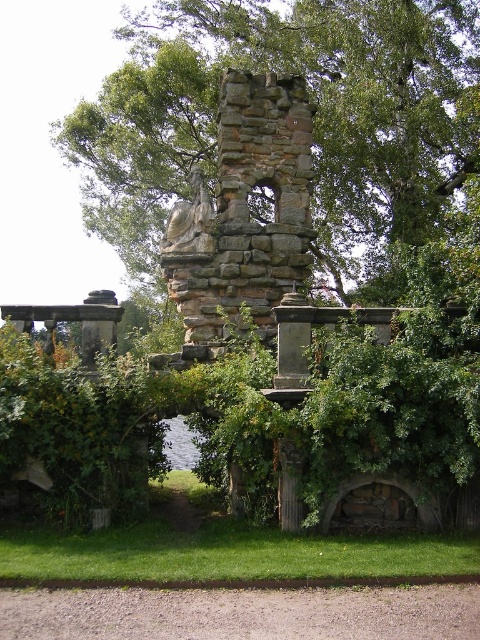
Question: Is green leafy tree at center further to camera compared to rustic stone chimney at center?

Choices:
 (A) no
 (B) yes

Answer: (B)

Question: Which point is farther to the camera?

Choices:
 (A) green leafy tree at center
 (B) rustic stone chimney at center

Answer: (A)

Question: Which of the following is the farthest from the observer?

Choices:
 (A) green leafy tree at center
 (B) rustic stone chimney at center

Answer: (A)

Question: Is green leafy tree at center positioned in front of rustic stone chimney at center?

Choices:
 (A) yes
 (B) no

Answer: (B)

Question: Which point is closer to the camera?

Choices:
 (A) rustic stone chimney at center
 (B) green leafy tree at center

Answer: (A)

Question: Can you confirm if green leafy tree at center is bigger than rustic stone chimney at center?

Choices:
 (A) no
 (B) yes

Answer: (B)